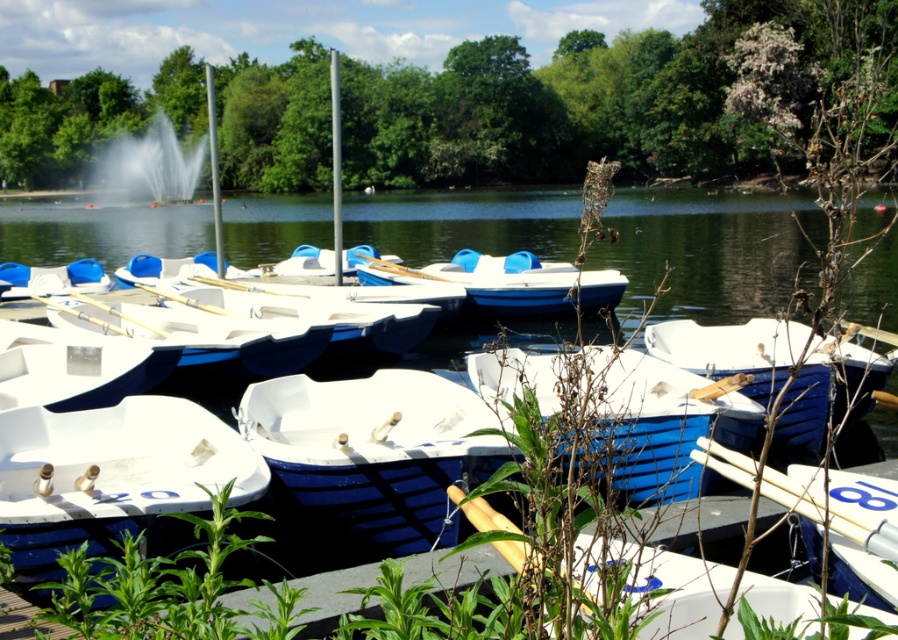
Question: Which of the following is the closest to the observer?

Choices:
 (A) white matte boat at center
 (B) white water at center

Answer: (A)

Question: Is white matte boat at center to the right of white water at center from the viewer's perspective?

Choices:
 (A) yes
 (B) no

Answer: (A)

Question: Which of the following is the farthest from the observer?

Choices:
 (A) (148, 152)
 (B) (161, 534)

Answer: (A)

Question: Is white matte boat at center thinner than white water at center?

Choices:
 (A) yes
 (B) no

Answer: (A)

Question: Which point is farther to the camera?

Choices:
 (A) white water at center
 (B) white matte boat at center

Answer: (A)

Question: Does white matte boat at center come behind white water at center?

Choices:
 (A) yes
 (B) no

Answer: (B)